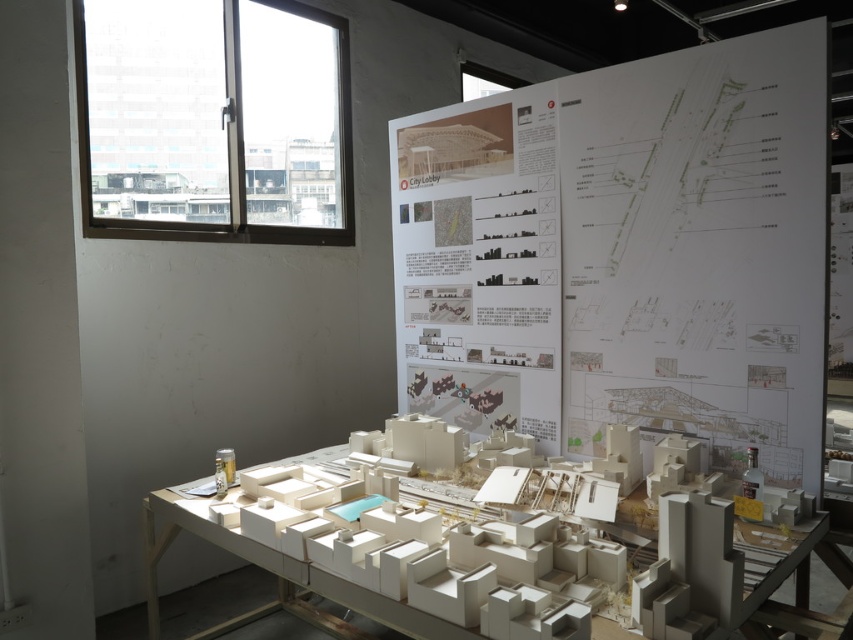
Question: Can you confirm if white paper poster at upper center is positioned above white cardboard model at center?

Choices:
 (A) yes
 (B) no

Answer: (A)

Question: Which point is closer to the camera?

Choices:
 (A) white cardboard model at center
 (B) white paper poster at upper center

Answer: (A)

Question: Is white paper poster at upper center above white cardboard model at center?

Choices:
 (A) no
 (B) yes

Answer: (B)

Question: Which object is farther from the camera taking this photo?

Choices:
 (A) white paper poster at upper center
 (B) white cardboard model at center

Answer: (A)

Question: Does white paper poster at upper center have a greater width compared to white cardboard model at center?

Choices:
 (A) yes
 (B) no

Answer: (B)